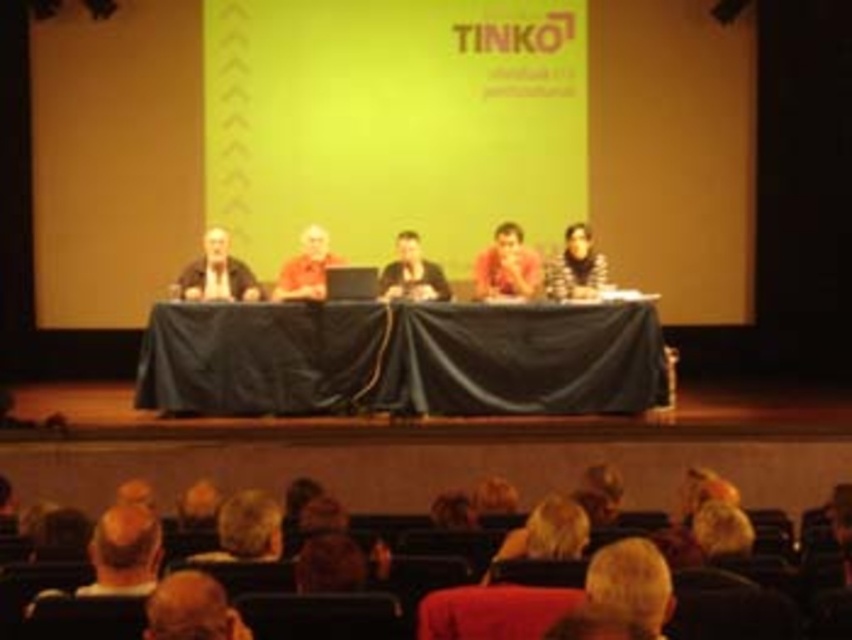
Between matte black suit at left and matte red shirt at center, which one is positioned lower?

matte black suit at left is below.

Who is shorter, matte black suit at left or matte red shirt at center?

With less height is matte black suit at left.

The width and height of the screenshot is (852, 640). I want to click on matte black suit at left, so click(x=216, y=273).

Can you confirm if matte black suit at left is taller than striped sweater at center?

Incorrect, matte black suit at left's height is not larger of striped sweater at center's.

Does matte black suit at left appear over striped sweater at center?

Incorrect, matte black suit at left is not positioned above striped sweater at center.

Between point (229, 292) and point (580, 246), which one is positioned behind?

The point (580, 246) is more distant.

Find the location of a particular element. matte black suit at left is located at coordinates (216, 273).

Does matte black shirt at center have a lesser width compared to matte orange shirt at center?

No, matte black shirt at center is not thinner than matte orange shirt at center.

How distant is matte black shirt at center from matte orange shirt at center?

A distance of 34.51 inches exists between matte black shirt at center and matte orange shirt at center.

This screenshot has width=852, height=640. Describe the element at coordinates (412, 273) in the screenshot. I see `matte black shirt at center` at that location.

Locate an element on the screen. The image size is (852, 640). matte black shirt at center is located at coordinates (412, 273).